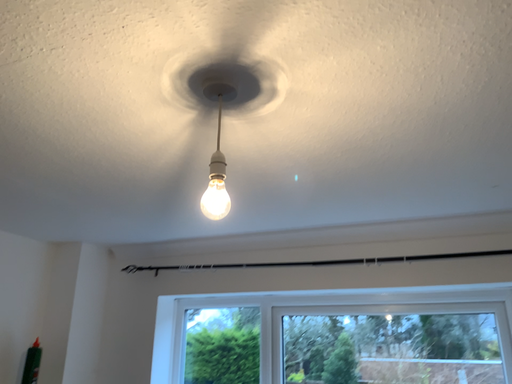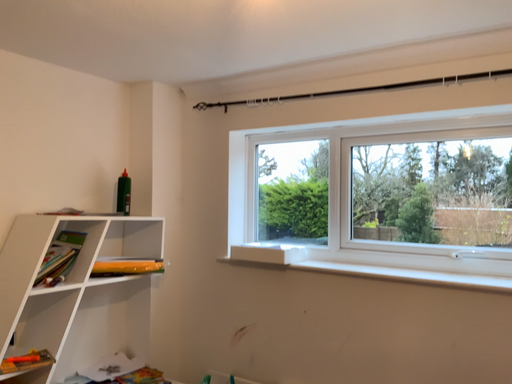
Question: How did the camera likely rotate when shooting the video?

Choices:
 (A) rotated downward
 (B) rotated upward

Answer: (A)